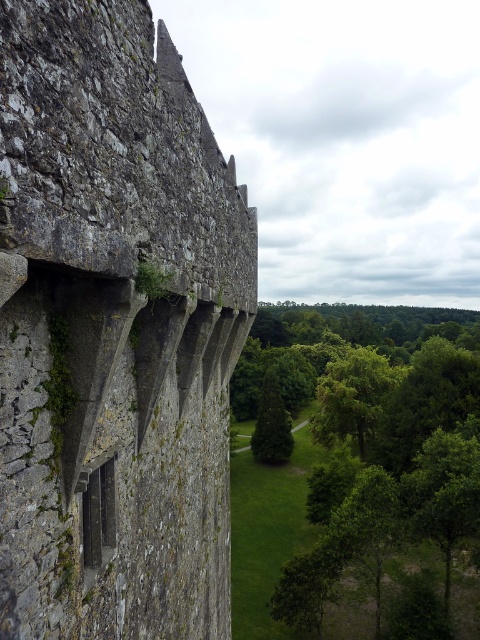
Can you confirm if rough stone wall at left is shorter than green leafy tree at center?

Correct, rough stone wall at left is not as tall as green leafy tree at center.

Looking at this image, who is lower down, rough stone wall at left or green leafy tree at center?

green leafy tree at center

Is point (181, 474) more distant than point (308, 444)?

No, (181, 474) is in front of (308, 444).

The width and height of the screenshot is (480, 640). What are the coordinates of `rough stone wall at left` in the screenshot? It's located at (115, 330).